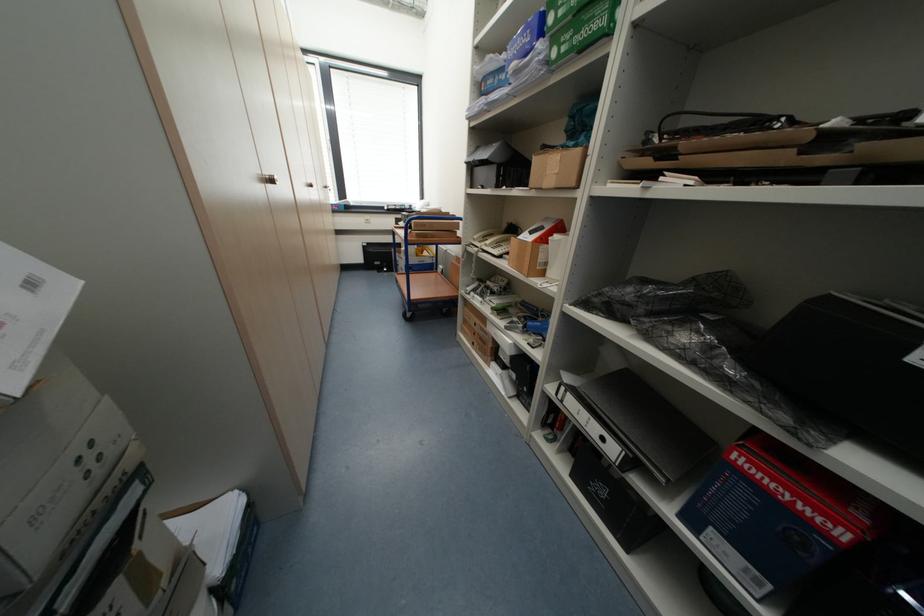
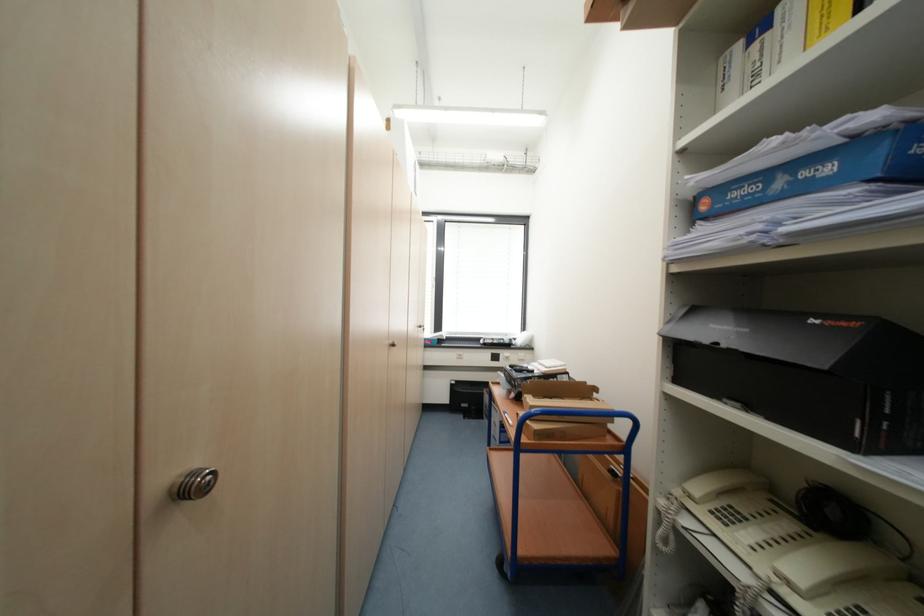
In the second image, find the point that corresponds to [424,236] in the first image.

(544, 436)